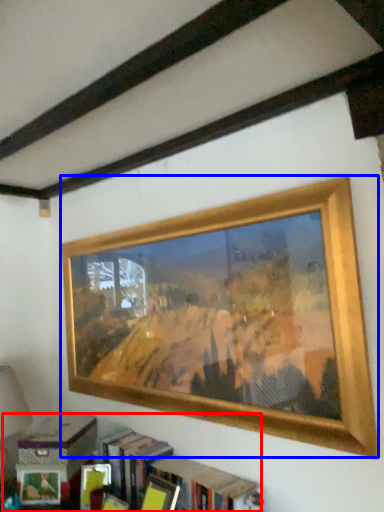
Question: Which object appears closest to the camera in this image, bookcase (highlighted by a red box) or picture frame (highlighted by a blue box)?

Choices:
 (A) bookcase
 (B) picture frame

Answer: (B)